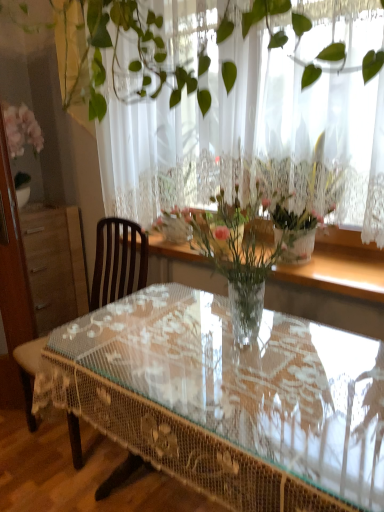
Question: From a real-world perspective, is clear glass table at center above or below brown wooden chair at left?

Choices:
 (A) above
 (B) below

Answer: (B)

Question: Would you say clear glass table at center is to the left or to the right of brown wooden chair at left in the picture?

Choices:
 (A) left
 (B) right

Answer: (B)

Question: Which of these objects is positioned farthest from the clear glass table at center?

Choices:
 (A) clear wood window sill at upper center
 (B) brown wooden chair at left
 (C) white lace curtain at upper center
 (D) clear glass vase at center

Answer: (B)

Question: Which is nearer to the clear glass vase at center?

Choices:
 (A) white lace curtain at upper center
 (B) clear glass table at center
 (C) brown wooden chair at left
 (D) clear wood window sill at upper center

Answer: (B)